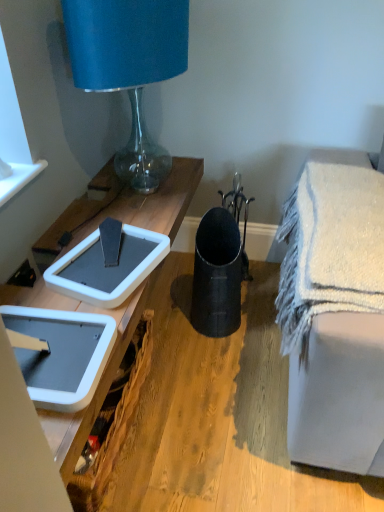
Question: From a real-world perspective, is white textured bath towel at lower right positioned over blue fabric lampshade at upper left based on gravity?

Choices:
 (A) no
 (B) yes

Answer: (A)

Question: Is white textured bath towel at lower right aimed at blue fabric lampshade at upper left?

Choices:
 (A) no
 (B) yes

Answer: (A)

Question: From a real-world perspective, does white textured bath towel at lower right sit lower than blue fabric lampshade at upper left?

Choices:
 (A) yes
 (B) no

Answer: (A)

Question: Does white textured bath towel at lower right have a larger size compared to blue fabric lampshade at upper left?

Choices:
 (A) yes
 (B) no

Answer: (B)

Question: Is white textured bath towel at lower right to the left of blue fabric lampshade at upper left from the viewer's perspective?

Choices:
 (A) yes
 (B) no

Answer: (B)

Question: Based on their positions, is matte black vase at center located to the left or right of blue fabric lampshade at upper left?

Choices:
 (A) right
 (B) left

Answer: (A)

Question: From the image's perspective, is matte black vase at center located above or below blue fabric lampshade at upper left?

Choices:
 (A) below
 (B) above

Answer: (A)

Question: Considering the positions of matte black vase at center and blue fabric lampshade at upper left in the image, is matte black vase at center taller or shorter than blue fabric lampshade at upper left?

Choices:
 (A) tall
 (B) short

Answer: (B)

Question: Is matte black vase at center in front of or behind blue fabric lampshade at upper left in the image?

Choices:
 (A) front
 (B) behind

Answer: (A)

Question: From the image's perspective, relative to matte black vase at center, is white textured bath towel at lower right above or below?

Choices:
 (A) below
 (B) above

Answer: (B)

Question: In the image, is white textured bath towel at lower right on the left side or the right side of matte black vase at center?

Choices:
 (A) left
 (B) right

Answer: (B)

Question: Is point (284, 266) closer or farther from the camera than point (274, 441)?

Choices:
 (A) farther
 (B) closer

Answer: (B)

Question: From their relative heights in the image, would you say white textured bath towel at lower right is taller or shorter than matte black vase at center?

Choices:
 (A) tall
 (B) short

Answer: (A)

Question: Is white plastic picnic basket at lower left to the left or to the right of blue fabric lampshade at upper left in the image?

Choices:
 (A) left
 (B) right

Answer: (A)

Question: In terms of height, does white plastic picnic basket at lower left look taller or shorter compared to blue fabric lampshade at upper left?

Choices:
 (A) tall
 (B) short

Answer: (B)